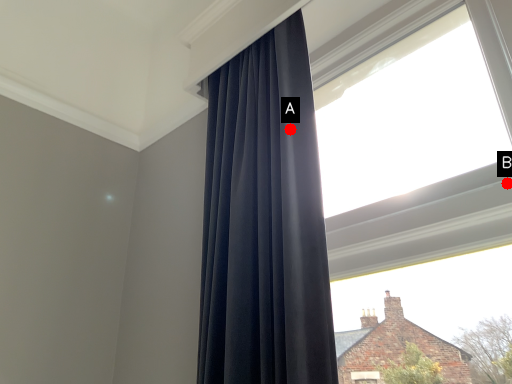
Question: Two points are circled on the image, labeled by A and B beside each circle. Among these points, which one is farthest from the camera?

Choices:
 (A) A is further
 (B) B is further

Answer: (A)